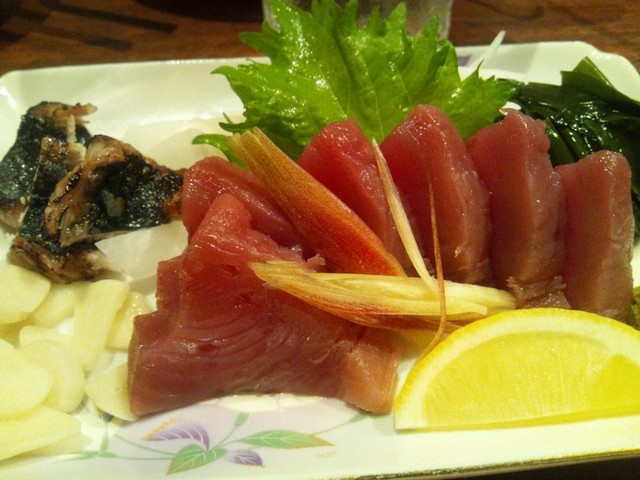
You are a GUI agent. You are given a task and a screenshot of the screen. Output one action in this format:
    pyautogui.click(x=<x>, y=<y>)
    Task: Click on the brown table
    The height and width of the screenshot is (480, 640).
    Given the screenshot: What is the action you would take?
    pyautogui.click(x=147, y=47)